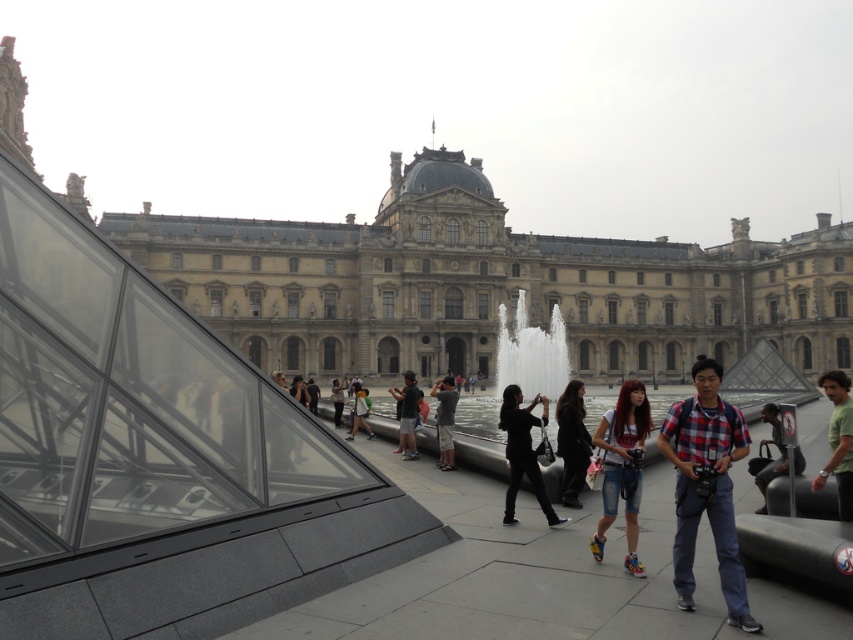
This screenshot has width=853, height=640. What do you see at coordinates (572, 442) in the screenshot?
I see `dark brown leather jacket at center` at bounding box center [572, 442].

Which of these two, dark brown leather jacket at center or dark blue jeans at center, stands shorter?

dark blue jeans at center

Is point (585, 432) in front of point (759, 509)?

No, it is not.

The width and height of the screenshot is (853, 640). In order to click on dark brown leather jacket at center in this screenshot , I will do `click(572, 442)`.

Between point (538, 500) and point (358, 404), which one is positioned in front?

Positioned in front is point (538, 500).

Locate an element on the screen. The image size is (853, 640). black fabric jacket at center is located at coordinates (523, 451).

Where is `black fabric jacket at center`? The image size is (853, 640). black fabric jacket at center is located at coordinates (523, 451).

Does dark gray pants at center have a greater height compared to matte black shirt at center?

Yes.

The image size is (853, 640). What do you see at coordinates (407, 413) in the screenshot?
I see `dark gray pants at center` at bounding box center [407, 413].

This screenshot has width=853, height=640. What are the coordinates of `dark gray pants at center` in the screenshot? It's located at (407, 413).